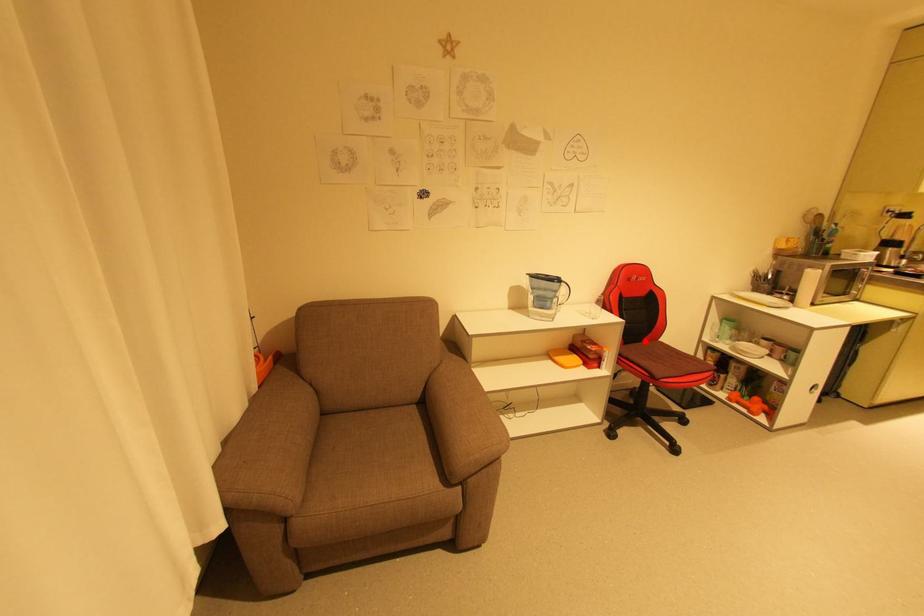
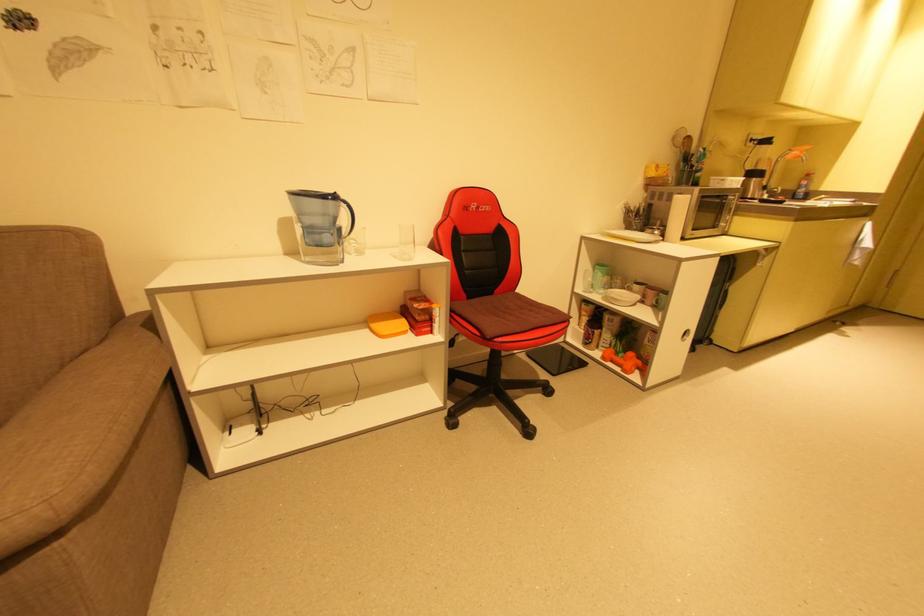
Where in the second image is the point corresponding to the highlighted location from the first image?

(495, 294)